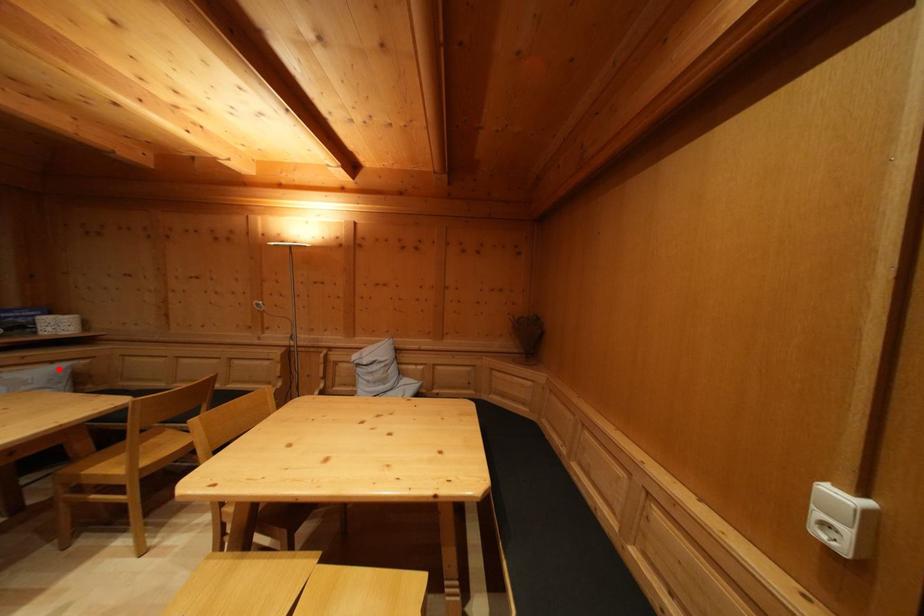
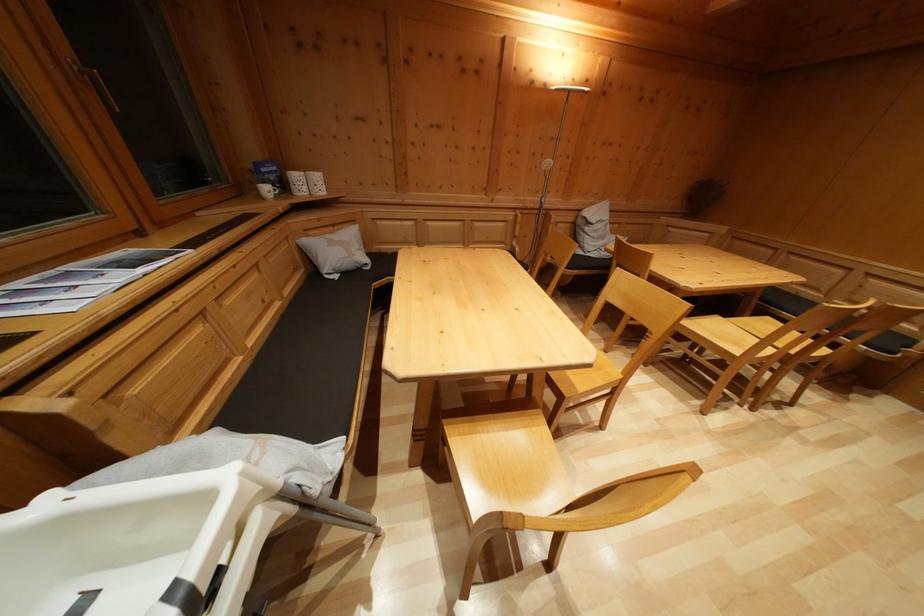
The point at the highlighted location is marked in the first image. Where is the corresponding point in the second image?

(338, 233)